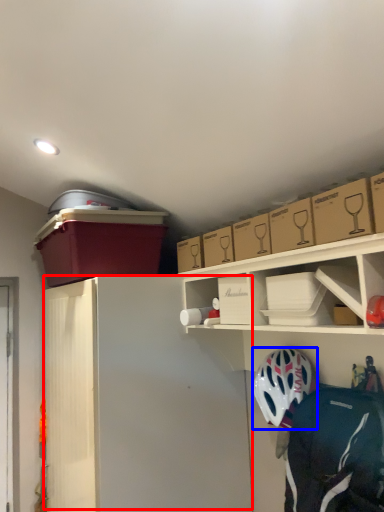
Question: Which point is closer to the camera, wide (highlighted by a red box) or helmet (highlighted by a blue box)?

Choices:
 (A) wide
 (B) helmet

Answer: (B)